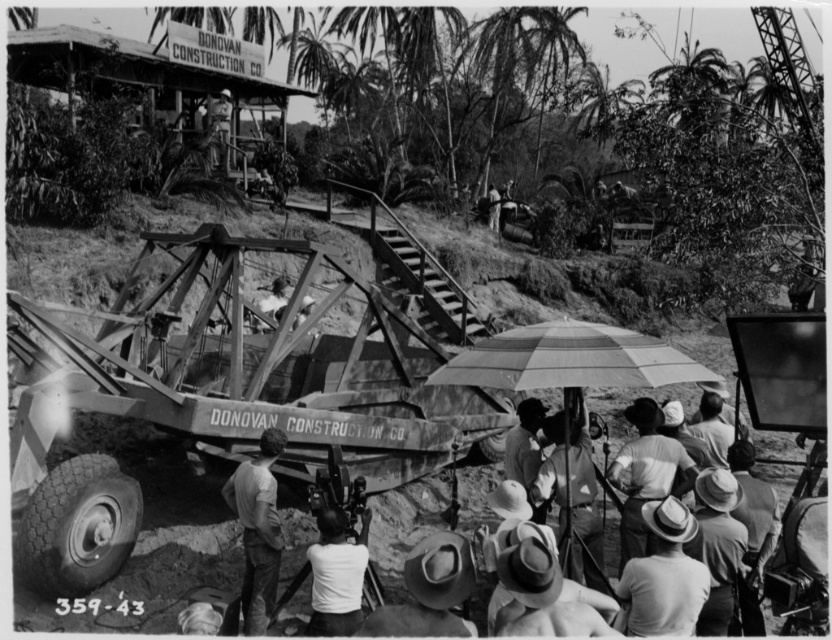
You are a photographer standing at the position of the camera. You want to capture a closeup shot of the light brown leather jacket at center. Is the jacket within your camera lens range if the camera has a maximum zoom of 5 meters?

The light brown leather jacket at center and camera are 7.25 meters apart. Since the camera can only zoom up to 5 meters, the jacket is beyond the maximum zoom range and cannot be captured in a closeup without moving closer.

In the scene shown: You are an observer looking at the construction site scene. You notice the light brown straw hat at lower center and the dark fabric shirt at center. Which object is shorter in height?

The light brown straw hat at lower center has a lesser height compared to the dark fabric shirt at center.

You are an observer standing at the edge of the construction site looking towards the machinery. You see the light brown straw hat at lower center and the light brown leather jacket at center. Which object is positioned lower in the image?

The light brown straw hat at lower center is positioned lower in the image than the light brown leather jacket at center.